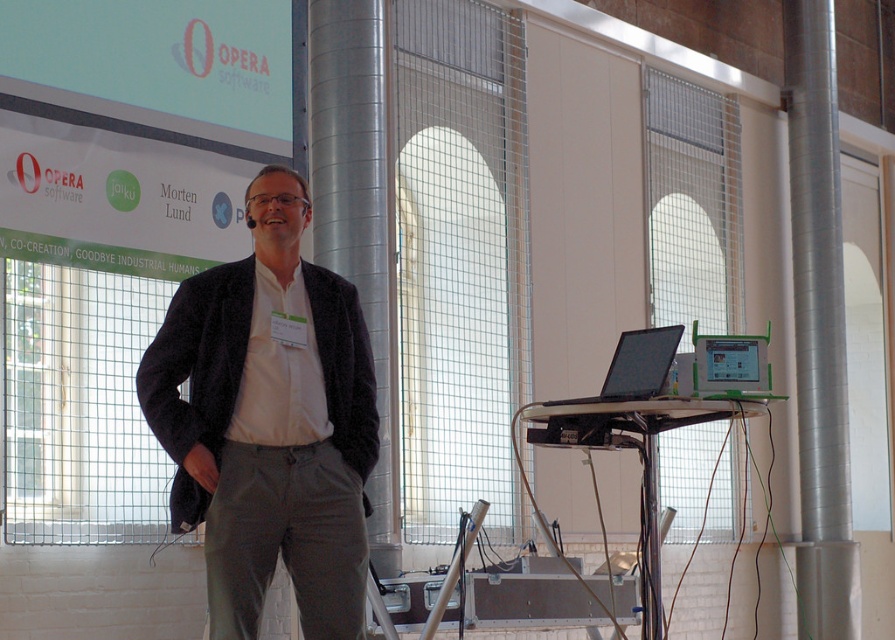
You are an interior designer planning to place a new sofa in the conference room. You see the dark gray textured blazer at center and the silver metallic pillar at right. Which object is closer to the left side of the room?

The dark gray textured blazer at center is closer to the left side of the room than the silver metallic pillar at right.

You are organizing a presentation in the conference room and need to place a 12 cm wide decorative item on the available space between the silver metallic pillar at center and the green plastic tablet at center. Can you fit it there?

The silver metallic pillar at center is bigger than the green plastic tablet at center, but the description does not provide the exact distance between them. Therefore, it is uncertain whether the 12 cm wide decorative item can fit in the space between them.

You are attending a presentation in the conference room and need to place a small note on the silver metallic pillar at center. Can you confirm the exact coordinates where the pillar is located?

The silver metallic pillar at center is located at point (356, 204), so you can place your note there.